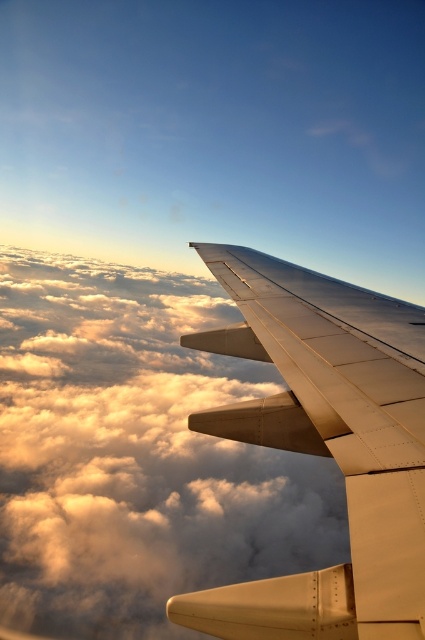
Question: From the image, what is the correct spatial relationship of cloudy white at upper center in relation to metallic silver wing at upper center?

Choices:
 (A) below
 (B) above

Answer: (A)

Question: Does cloudy white at upper center have a greater width compared to metallic silver wing at upper center?

Choices:
 (A) no
 (B) yes

Answer: (B)

Question: Is the position of cloudy white at upper center less distant than that of metallic silver wing at upper center?

Choices:
 (A) no
 (B) yes

Answer: (A)

Question: Which point is closer to the camera taking this photo?

Choices:
 (A) (11, 467)
 (B) (312, 624)

Answer: (B)

Question: Among these points, which one is nearest to the camera?

Choices:
 (A) (384, 490)
 (B) (181, 554)

Answer: (A)